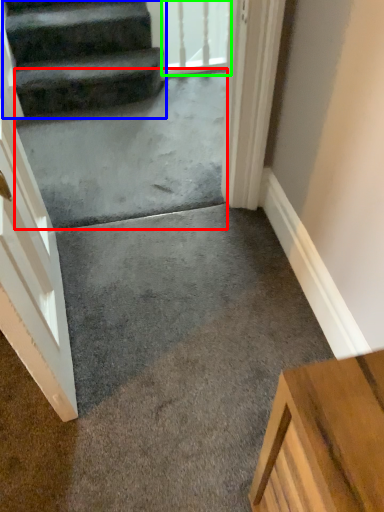
Question: Which object is positioned farthest from concrete (highlighted by a red box)? Select from stairs (highlighted by a blue box) and glass door (highlighted by a green box).

Choices:
 (A) stairs
 (B) glass door

Answer: (B)